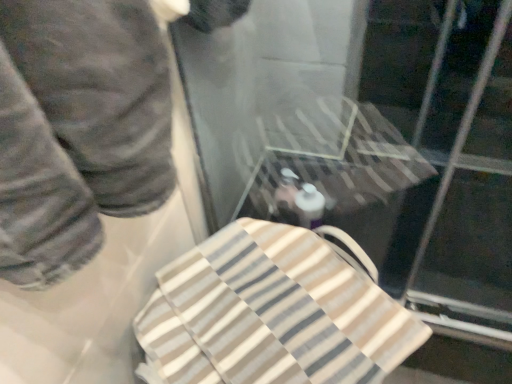
Identify the location of dark gray pants at left. The height and width of the screenshot is (384, 512). (78, 130).

You are a GUI agent. You are given a task and a screenshot of the screen. Output one action in this format:
    pyautogui.click(x=<x>, y=<y>)
    Task: Click on the transparent plastic glass door at upper center
    This screenshot has width=512, height=384.
    Given the screenshot: What is the action you would take?
    pyautogui.click(x=371, y=138)

Identify the location of beige striped towel at center. (271, 314).

Considering the sizes of objects dark gray pants at left and transparent plastic glass door at upper center in the image provided, who is bigger, dark gray pants at left or transparent plastic glass door at upper center?

With larger size is transparent plastic glass door at upper center.

Does dark gray pants at left have a greater height compared to transparent plastic glass door at upper center?

Indeed, dark gray pants at left has a greater height compared to transparent plastic glass door at upper center.

From the image's perspective, is dark gray pants at left over transparent plastic glass door at upper center?

Yes.

Is dark gray pants at left wider or thinner than transparent plastic glass door at upper center?

In the image, dark gray pants at left appears to be more narrow than transparent plastic glass door at upper center.

Considering the relative positions of transparent plastic glass door at upper center and beige striped towel at center in the image provided, is transparent plastic glass door at upper center to the right of beige striped towel at center from the viewer's perspective?

Indeed, transparent plastic glass door at upper center is positioned on the right side of beige striped towel at center.

In terms of width, does transparent plastic glass door at upper center look wider or thinner when compared to beige striped towel at center?

Considering their sizes, transparent plastic glass door at upper center looks broader than beige striped towel at center.

Based on the photo, is transparent plastic glass door at upper center positioned far away from beige striped towel at center?

transparent plastic glass door at upper center is near beige striped towel at center, not far away.

Is transparent plastic glass door at upper center taller than beige striped towel at center?

No.

How different are the orientations of beige striped towel at center and transparent plastic glass door at upper center in degrees?

The angle between the facing direction of beige striped towel at center and the facing direction of transparent plastic glass door at upper center is 59.8 degrees.

Which of these two, beige striped towel at center or transparent plastic glass door at upper center, is smaller?

beige striped towel at center is smaller.

In the scene shown: Is beige striped towel at center beside transparent plastic glass door at upper center?

No.

Is transparent plastic glass door at upper center at the back of beige striped towel at center?

That's not correct — beige striped towel at center is not looking away from transparent plastic glass door at upper center.

Between beige striped towel at center and dark gray pants at left, which one appears on the left side from the viewer's perspective?

From the viewer's perspective, dark gray pants at left appears more on the left side.

Choose the correct answer: Is beige striped towel at center inside dark gray pants at left or outside it?

beige striped towel at center is not inside dark gray pants at left, it's outside.

Consider the image. Between beige striped towel at center and dark gray pants at left, which one has more height?

With more height is dark gray pants at left.

Are beige striped towel at center and dark gray pants at left far apart?

They are positioned close to each other.

How different are the orientations of transparent plastic glass door at upper center and dark gray pants at left in degrees?

They differ by 93.8 degrees in their facing directions.

Which object is more forward, transparent plastic glass door at upper center or dark gray pants at left?

dark gray pants at left.

From the image's perspective, which is above, transparent plastic glass door at upper center or dark gray pants at left?

From the image's view, dark gray pants at left is above.

Is transparent plastic glass door at upper center beside dark gray pants at left?

No, transparent plastic glass door at upper center is not touching dark gray pants at left.

Between dark gray pants at left and beige striped towel at center, which one appears on the right side from the viewer's perspective?

beige striped towel at center.

This screenshot has height=384, width=512. What are the coordinates of `person above the beige striped towel at center (from a real-world perspective)` in the screenshot? It's located at (78, 130).

From the image's perspective, which is below, dark gray pants at left or beige striped towel at center?

beige striped towel at center, from the image's perspective.

In terms of height, does dark gray pants at left look taller or shorter compared to beige striped towel at center?

Considering their sizes, dark gray pants at left has more height than beige striped towel at center.

The image size is (512, 384). Find the location of `glass door located underneath the dark gray pants at left (from a real-world perspective)`. glass door located underneath the dark gray pants at left (from a real-world perspective) is located at coordinates (371, 138).

Where is `beach towel lying below the transparent plastic glass door at upper center (from the image's perspective)`? This screenshot has height=384, width=512. beach towel lying below the transparent plastic glass door at upper center (from the image's perspective) is located at coordinates (271, 314).

Looking at the image, which one is located further to dark gray pants at left, beige striped towel at center or transparent plastic glass door at upper center?

transparent plastic glass door at upper center is positioned further to the anchor dark gray pants at left.

When comparing their distances from transparent plastic glass door at upper center, does beige striped towel at center or dark gray pants at left seem closer?

Among the two, beige striped towel at center is located nearer to transparent plastic glass door at upper center.

Based on their spatial positions, is transparent plastic glass door at upper center or beige striped towel at center closer to dark gray pants at left?

Based on the image, beige striped towel at center appears to be nearer to dark gray pants at left.

Estimate the real-world distances between objects in this image. Which object is further from transparent plastic glass door at upper center, dark gray pants at left or beige striped towel at center?

dark gray pants at left is positioned further to the anchor transparent plastic glass door at upper center.

Considering their positions, is dark gray pants at left positioned closer to beige striped towel at center than transparent plastic glass door at upper center?

dark gray pants at left is closer to beige striped towel at center.

From the image, which object appears to be farther from beige striped towel at center, transparent plastic glass door at upper center or dark gray pants at left?

Among the two, transparent plastic glass door at upper center is located further to beige striped towel at center.

At what (x,y) coordinates should I click in order to perform the action: click on beach towel located between dark gray pants at left and transparent plastic glass door at upper center in the depth direction. Please return your answer as a coordinate pair (x, y). Looking at the image, I should click on (x=271, y=314).